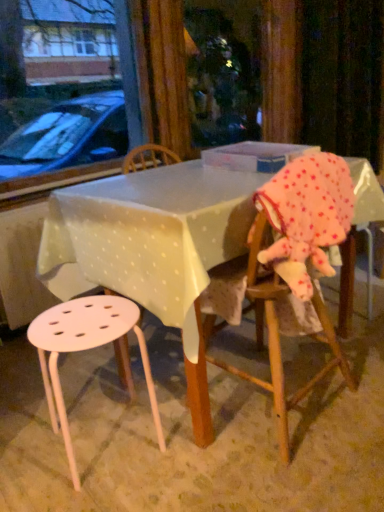
At what (x,y) coordinates should I click in order to perform the action: click on vacant area that lies to the right of white plastic stool at lower left. Please return your answer as a coordinate pair (x, y). The height and width of the screenshot is (512, 384). Looking at the image, I should click on (190, 449).